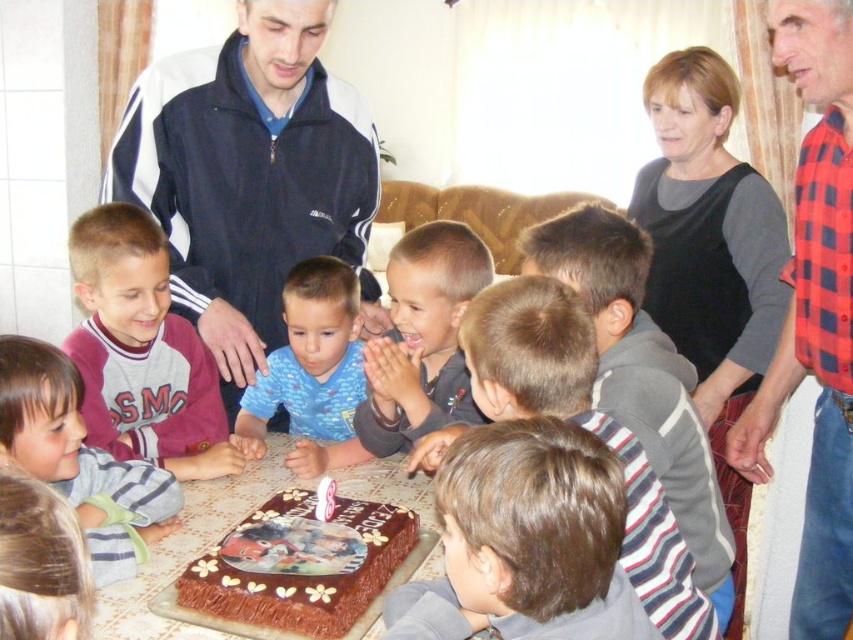
You are a photographer standing at the back of the room. You want to take a photo of the chocolatesmoothcake at center and the dark blue jacket at upper center so that both are in the frame. Given that your camera has a maximum focus range of 28 inches, will you be able to capture both objects in focus?

The dark blue jacket at upper center and chocolatesmoothcake at center are 27.96 inches apart from each other. Since the distance between them is within the camera maximum focus range of 28 inches, both objects will be in focus.

You are a photographer standing at the center of the room. You want to take a photo of the gray fleece shirt at lower left. Which direction should you move to face the shirt?

The gray fleece shirt at lower left is located at point (79, 460), so you should move to the lower left direction to face the shirt.

You are a photographer at the birthday party and want to take a photo of the two children wearing the gray fleece shirt at lower left and blue cotton shirt at center. Since you can only focus on one child at a time, which child should you focus on first to ensure both are in the frame?

You should focus on the gray fleece shirt at lower left first because it is positioned to the left of the blue cotton shirt at center, so starting with the leftmost child ensures the right child will also be in the frame.